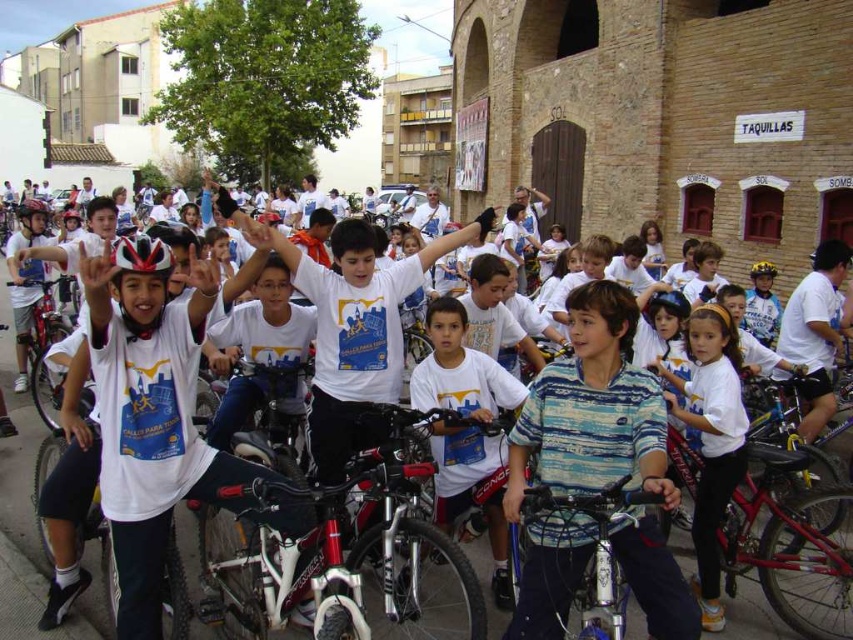
Question: Which object is positioned closest to the white matte shirt at center?

Choices:
 (A) shiny red bicycle at center
 (B) metallic blue bicycle at center
 (C) shiny metallic bicycle at center
 (D) white matte bicycle helmet at upper left

Answer: (C)

Question: Which object is the closest to the white cotton shirt at center?

Choices:
 (A) shiny metallic bicycle at center
 (B) white matte shirt at center

Answer: (B)

Question: Is white matte shirt at center positioned at the back of white matte bicycle helmet at center?

Choices:
 (A) no
 (B) yes

Answer: (A)

Question: Does shiny red bicycle at center lie in front of matte black helmet at center?

Choices:
 (A) no
 (B) yes

Answer: (B)

Question: Which of the following is the farthest from the observer?

Choices:
 (A) (759, 273)
 (B) (132, 259)

Answer: (A)

Question: Is white matte shirt at center further to the viewer compared to white cotton shirt at center?

Choices:
 (A) no
 (B) yes

Answer: (A)